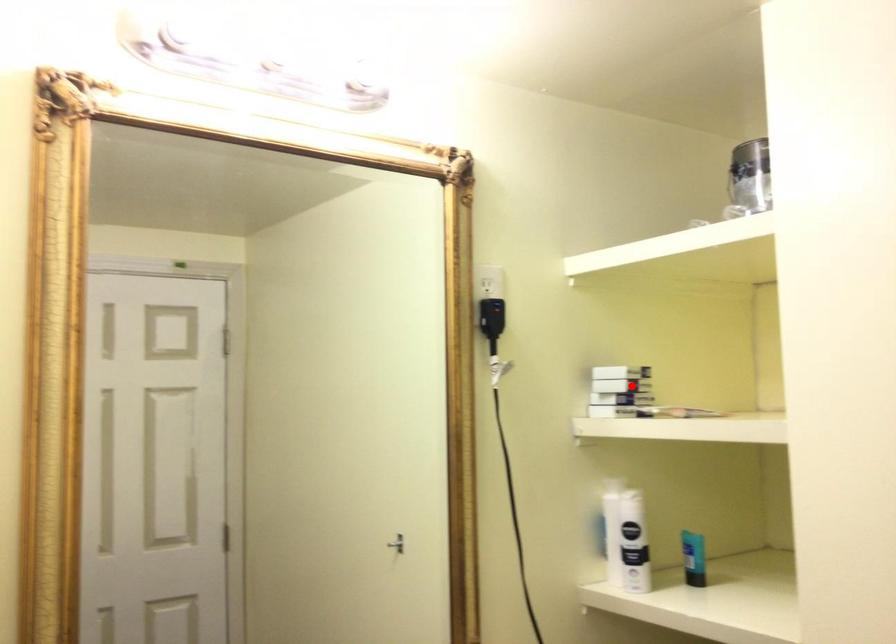
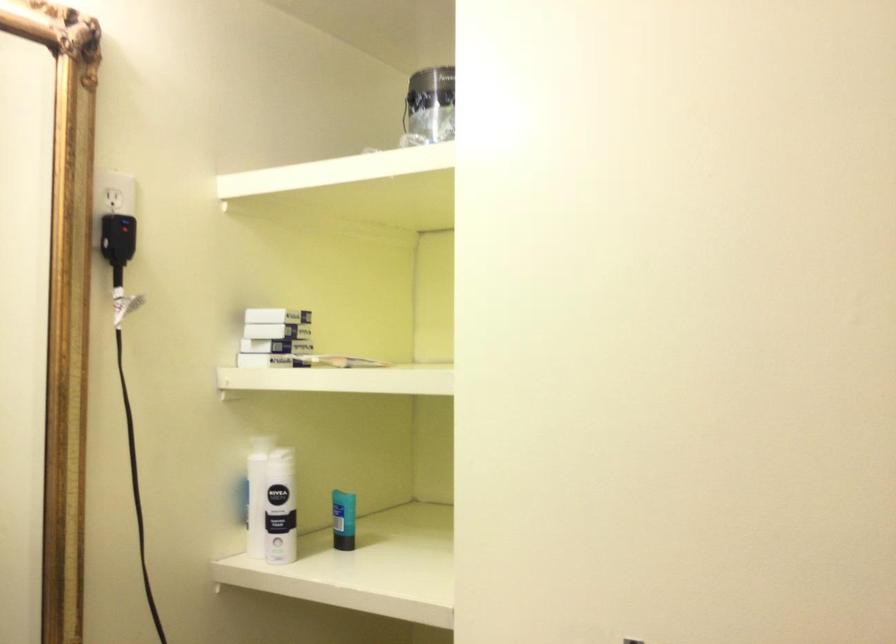
In the second image, find the point that corresponds to the highlighted location in the first image.

(277, 330)